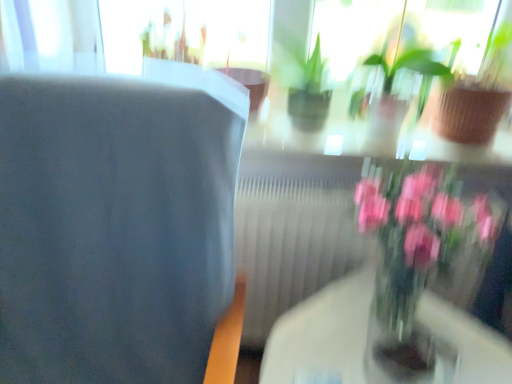
Question: Which is correct: green matte plant at upper right, which is counted as the first houseplant, starting from the right, is inside green glossy houseplant at upper center, the 1th houseplant positioned from the left, or outside of it?

Choices:
 (A) inside
 (B) outside

Answer: (B)

Question: From a real-world perspective, is green matte plant at upper right, which is counted as the first houseplant, starting from the right, physically located above or below green glossy houseplant at upper center, the 1th houseplant positioned from the left?

Choices:
 (A) below
 (B) above

Answer: (B)

Question: Which object is positioned closest to the green matte plant at upper right, which is counted as the first houseplant, starting from the right?

Choices:
 (A) green glossy houseplant at upper center, the 1th houseplant positioned from the left
 (B) clear glass vase at center
 (C) transparent glass door at upper center
 (D) blue fabric chair at left
 (E) pink glass vase at right

Answer: (A)

Question: Estimate the real-world distances between objects in this image. Which object is closer to the clear glass vase at center?

Choices:
 (A) blue fabric chair at left
 (B) green glossy houseplant at upper center, which is counted as the 2th houseplant, starting from the right
 (C) transparent glass door at upper center
 (D) pink glass vase at right
 (E) green matte plant at upper right, which is counted as the first houseplant, starting from the right

Answer: (D)